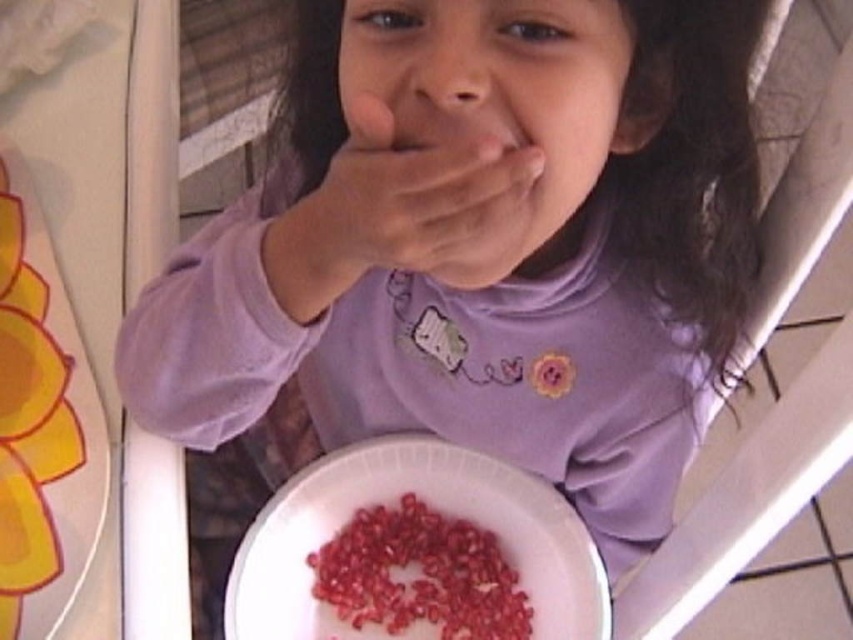
Question: Is pomegranate seeds at center positioned before red glossy pomegranate seeds at lower center?

Choices:
 (A) yes
 (B) no

Answer: (A)

Question: Which point appears farthest from the camera in this image?

Choices:
 (A) (364, 182)
 (B) (268, 602)

Answer: (B)

Question: Which point is closer to the camera?

Choices:
 (A) (358, 616)
 (B) (553, 490)

Answer: (B)

Question: Can you confirm if pomegranate seeds at center is positioned to the right of smooth skin hand at center?

Choices:
 (A) no
 (B) yes

Answer: (B)

Question: Can you confirm if smooth skin hand at center is positioned to the right of red glossy pomegranate seeds at lower center?

Choices:
 (A) no
 (B) yes

Answer: (A)

Question: Which point is closer to the camera taking this photo?

Choices:
 (A) [364, 500]
 (B) [386, 212]
 (C) [402, 504]

Answer: (B)